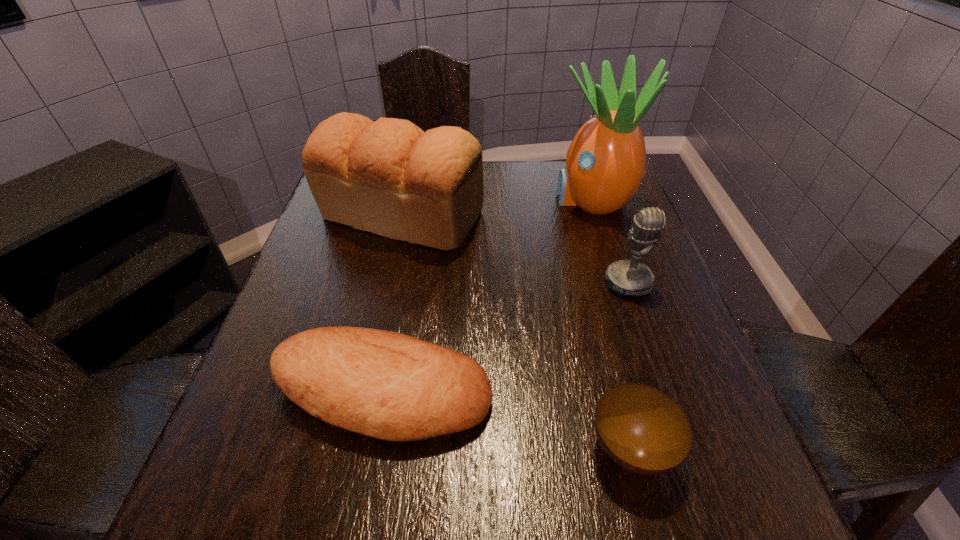
At what (x,y) coordinates should I click in order to perform the action: click on pineapple. Please return your answer as a coordinate pair (x, y). The height and width of the screenshot is (540, 960). Looking at the image, I should click on (606, 162).

Locate an element on the screen. The height and width of the screenshot is (540, 960). the taller bread is located at coordinates (389, 177).

Image resolution: width=960 pixels, height=540 pixels. Find the location of `the farther bread`. the farther bread is located at coordinates (389, 177).

Where is `the third farthest object`? the third farthest object is located at coordinates (624, 277).

In order to click on the third shortest object in this screenshot , I will do `click(624, 277)`.

Where is `the nearer bread`? the nearer bread is located at coordinates (387, 385).

Identify the location of the shorter bread. (387, 385).

Where is `the shortest object`? The width and height of the screenshot is (960, 540). the shortest object is located at coordinates (641, 429).

You are a GUI agent. You are given a task and a screenshot of the screen. Output one action in this format:
    pyautogui.click(x=<x>, y=<y>)
    Task: Click on the vacant space located at the entrance of the pineapple
    The width and height of the screenshot is (960, 540).
    Given the screenshot: What is the action you would take?
    pyautogui.click(x=461, y=199)

This screenshot has height=540, width=960. I want to click on vacant space situated at the entrance of the pineapple, so click(504, 199).